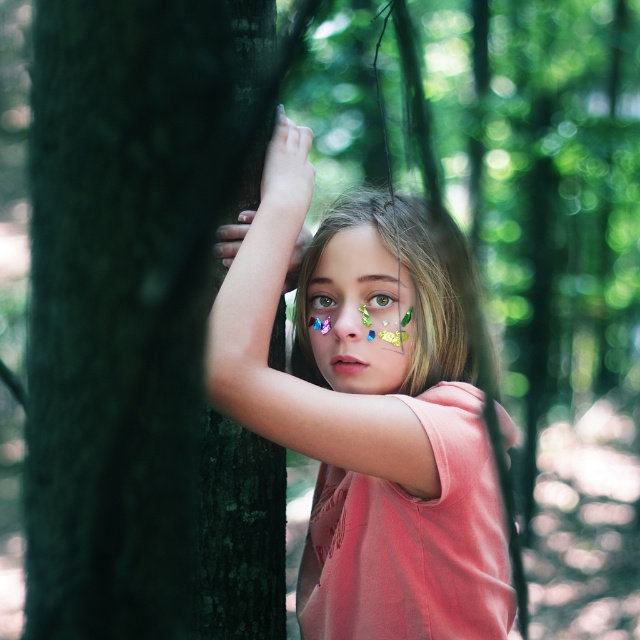
You are a photographer trying to capture a portrait of the girl. You notice the dark green bark at left and the shiny metallic face at center in your frame. Which object is taller in the image?

The dark green bark at left is taller than the shiny metallic face at center.

Based on the scene description, can you determine which object is positioned higher in the image between the dark green bark at left and the pink matte shirt at center?

The dark green bark at left is positioned higher than the pink matte shirt at center in the image.

You are a photographer trying to capture the girl in the forest. You notice the shiny metallic face at center and the green iridescent eye at center. Which object should you focus on first if you want to capture the one that is positioned to the left?

The shiny metallic face at center is to the left of the green iridescent eye at center, so you should focus on the shiny metallic face at center first.